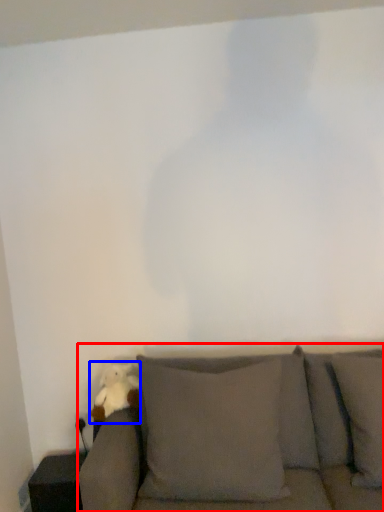
Question: Among these objects, which one is farthest to the camera, studio couch (highlighted by a red box) or toy (highlighted by a blue box)?

Choices:
 (A) studio couch
 (B) toy

Answer: (B)